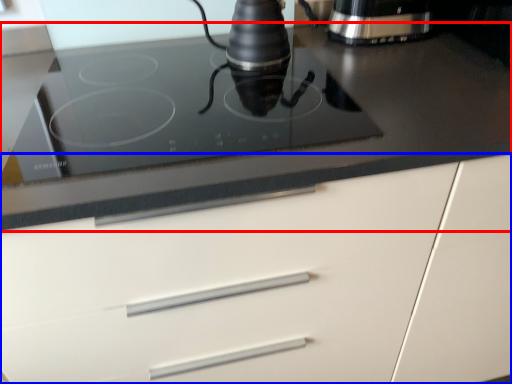
Question: Which of the following is the closest to the observer, countertop (highlighted by a red box) or cabinetry (highlighted by a blue box)?

Choices:
 (A) countertop
 (B) cabinetry

Answer: (B)